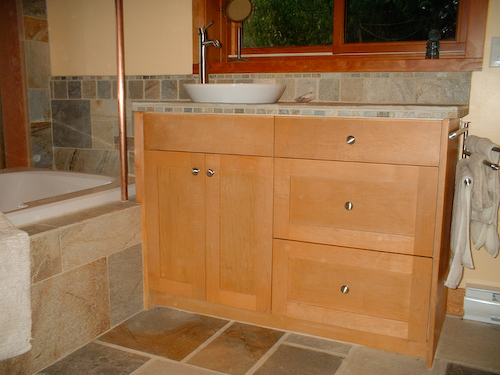
I want to click on mirror, so click(x=237, y=12).